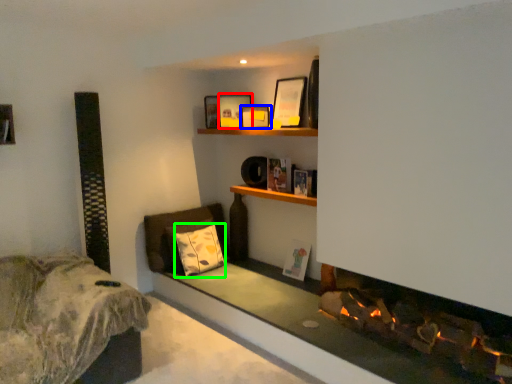
Question: Based on their relative distances, which object is farther from picture frame (highlighted by a red box)? Choose from picture frame (highlighted by a blue box) and pillow (highlighted by a green box).

Choices:
 (A) picture frame
 (B) pillow

Answer: (B)